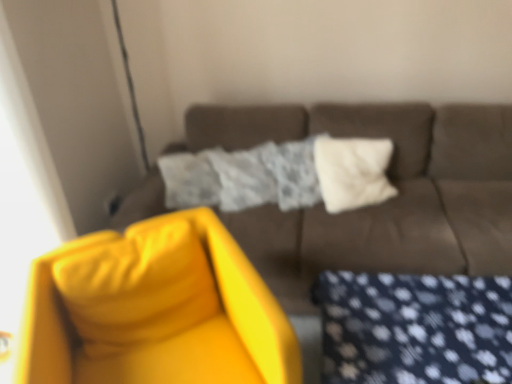
Where is `white soft pillow at center`? The width and height of the screenshot is (512, 384). white soft pillow at center is located at coordinates (353, 171).

The height and width of the screenshot is (384, 512). I want to click on matte brown couch at center, so click(382, 203).

Locate an element on the screen. The width and height of the screenshot is (512, 384). white soft pillow at center is located at coordinates (353, 171).

Considering the sizes of objects matte brown couch at center and matte yellow swivel chair at left in the image provided, who is thinner, matte brown couch at center or matte yellow swivel chair at left?

With smaller width is matte yellow swivel chair at left.

Are matte brown couch at center and matte yellow swivel chair at left beside each other?

matte brown couch at center and matte yellow swivel chair at left are clearly separated.

Who is shorter, matte brown couch at center or matte yellow swivel chair at left?

matte yellow swivel chair at left.

How far apart are matte brown couch at center and matte yellow swivel chair at left?

matte brown couch at center is 73.66 centimeters away from matte yellow swivel chair at left.

From a real-world perspective, relative to white soft pillow at center, is matte yellow swivel chair at left vertically above or below?

From a real-world perspective, matte yellow swivel chair at left is physically below white soft pillow at center.

Measure the distance between matte yellow swivel chair at left and white soft pillow at center.

matte yellow swivel chair at left is 38.24 inches from white soft pillow at center.

Based on the photo, is matte yellow swivel chair at left facing towards white soft pillow at center?

No, matte yellow swivel chair at left is not turned towards white soft pillow at center.

Considering the sizes of matte yellow swivel chair at left and white soft pillow at center in the image, is matte yellow swivel chair at left wider or thinner than white soft pillow at center?

Clearly, matte yellow swivel chair at left has more width compared to white soft pillow at center.

Based on the photo, is matte yellow swivel chair at left located outside matte brown couch at center?

matte yellow swivel chair at left lies outside matte brown couch at center's area.

Looking at the image, does matte yellow swivel chair at left seem bigger or smaller compared to matte brown couch at center?

Considering their sizes, matte yellow swivel chair at left takes up less space than matte brown couch at center.

Between point (168, 382) and point (431, 239), which one is positioned behind?

The point (431, 239) is behind.

Is white soft pillow at center oriented towards matte yellow swivel chair at left?

No.

Is white soft pillow at center next to matte yellow swivel chair at left and touching it?

There is a gap between white soft pillow at center and matte yellow swivel chair at left.

Considering the positions of objects white soft pillow at center and matte yellow swivel chair at left in the image provided, who is more to the left, white soft pillow at center or matte yellow swivel chair at left?

Positioned to the left is matte yellow swivel chair at left.

What are the coordinates of `pillow behind the matte yellow swivel chair at left` in the screenshot? It's located at (353, 171).

Locate an element on the screen. The image size is (512, 384). studio couch in front of the white soft pillow at center is located at coordinates (382, 203).

Is there a large distance between matte brown couch at center and white soft pillow at center?

They are positioned close to each other.

Which is more to the left, matte brown couch at center or white soft pillow at center?

From the viewer's perspective, matte brown couch at center appears more on the left side.

Which is behind, point (298, 288) or point (369, 152)?

Positioned behind is point (369, 152).

Is white soft pillow at center closer to the viewer compared to matte brown couch at center?

No, white soft pillow at center is further to the viewer.

Does white soft pillow at center have a lesser width compared to matte brown couch at center?

Yes.

Considering the positions of points (353, 179) and (474, 144), is point (353, 179) closer to camera compared to point (474, 144)?

No, (353, 179) is further to viewer.

The image size is (512, 384). In order to click on studio couch above the matte yellow swivel chair at left (from a real-world perspective) in this screenshot , I will do `click(382, 203)`.

Where is `swivel chair to the left of white soft pillow at center`? This screenshot has width=512, height=384. swivel chair to the left of white soft pillow at center is located at coordinates (154, 310).

From the image, which object appears to be farther from matte yellow swivel chair at left, white soft pillow at center or matte brown couch at center?

white soft pillow at center.

From the image, which object appears to be farther from white soft pillow at center, matte brown couch at center or matte yellow swivel chair at left?

The object further to white soft pillow at center is matte yellow swivel chair at left.

When comparing their distances from white soft pillow at center, does matte yellow swivel chair at left or matte brown couch at center seem closer?

Among the two, matte brown couch at center is located nearer to white soft pillow at center.

Considering their positions, is matte yellow swivel chair at left positioned closer to matte brown couch at center than white soft pillow at center?

white soft pillow at center lies closer to matte brown couch at center than the other object.

In the scene shown: Looking at the image, which one is located closer to matte yellow swivel chair at left, matte brown couch at center or white soft pillow at center?

matte brown couch at center is closer to matte yellow swivel chair at left.

Estimate the real-world distances between objects in this image. Which object is closer to matte brown couch at center, white soft pillow at center or matte yellow swivel chair at left?

white soft pillow at center is positioned closer to the anchor matte brown couch at center.

Find the location of a particular element. The image size is (512, 384). studio couch positioned between matte yellow swivel chair at left and white soft pillow at center from near to far is located at coordinates (382, 203).